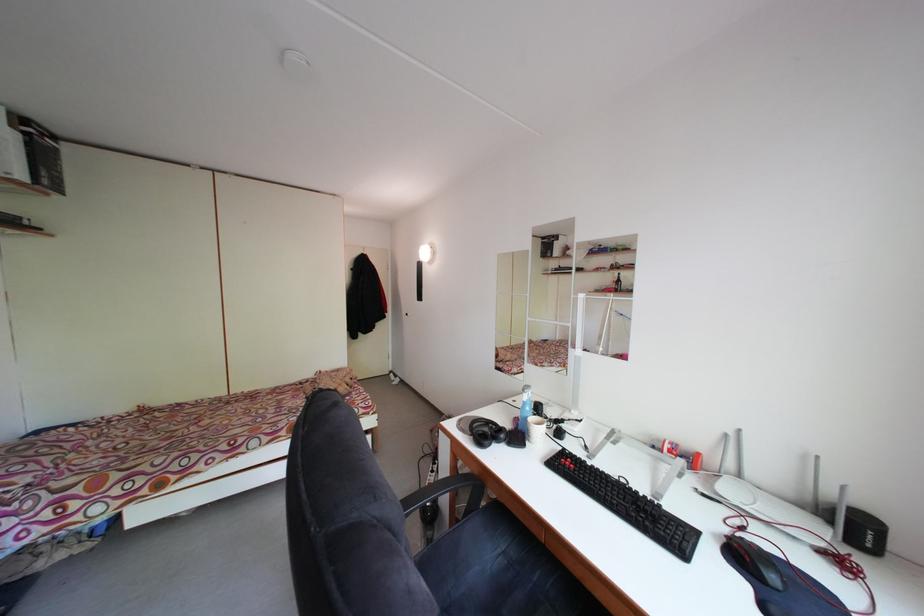
You are a GUI agent. You are given a task and a screenshot of the screen. Output one action in this format:
    pyautogui.click(x=<x>, y=<y>)
    Task: Click on the dark glass bottle
    
    Given the screenshot: What is the action you would take?
    pyautogui.click(x=617, y=283)